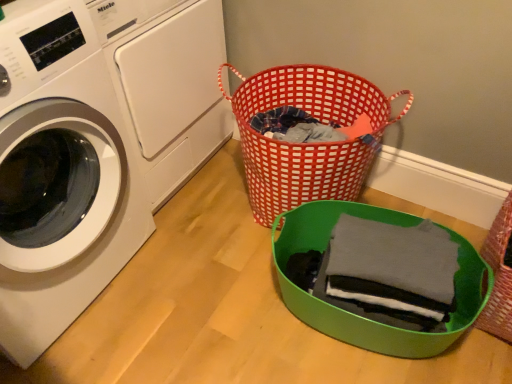
Question: Is dark gray cotton shirt at center at the back of white glossy washing machine at upper left, arranged as the first washing machine when viewed from the back?

Choices:
 (A) yes
 (B) no

Answer: (B)

Question: Is dark gray cotton shirt at center located within white glossy washing machine at upper left, arranged as the first washing machine when viewed from the back?

Choices:
 (A) yes
 (B) no

Answer: (B)

Question: Is white glossy washing machine at upper left, arranged as the first washing machine when viewed from the back, to the left of dark gray cotton shirt at center from the viewer's perspective?

Choices:
 (A) yes
 (B) no

Answer: (A)

Question: Can you confirm if white glossy washing machine at upper left, which ranks as the second washing machine in front-to-back order, is taller than dark gray cotton shirt at center?

Choices:
 (A) no
 (B) yes

Answer: (B)

Question: Is white glossy washing machine at upper left, arranged as the first washing machine when viewed from the back, directly adjacent to dark gray cotton shirt at center?

Choices:
 (A) yes
 (B) no

Answer: (B)

Question: Does white glossy washing machine at upper left, arranged as the first washing machine when viewed from the back, have a larger size compared to dark gray cotton shirt at center?

Choices:
 (A) no
 (B) yes

Answer: (B)

Question: Is dark gray cotton shirt at center taller than white glossy washing machine at left, arranged as the 1th washing machine when viewed from the front?

Choices:
 (A) yes
 (B) no

Answer: (B)

Question: Is dark gray cotton shirt at center not within white glossy washing machine at left, arranged as the 1th washing machine when viewed from the front?

Choices:
 (A) yes
 (B) no

Answer: (A)

Question: Can you confirm if dark gray cotton shirt at center is shorter than white glossy washing machine at left, arranged as the 1th washing machine when viewed from the front?

Choices:
 (A) no
 (B) yes

Answer: (B)

Question: From a real-world perspective, is dark gray cotton shirt at center over white glossy washing machine at left, which appears as the second washing machine when viewed from the back?

Choices:
 (A) yes
 (B) no

Answer: (B)

Question: Does dark gray cotton shirt at center have a smaller size compared to white glossy washing machine at left, arranged as the 1th washing machine when viewed from the front?

Choices:
 (A) no
 (B) yes

Answer: (B)

Question: Are dark gray cotton shirt at center and white glossy washing machine at left, arranged as the 1th washing machine when viewed from the front, far apart?

Choices:
 (A) yes
 (B) no

Answer: (B)

Question: From the image's perspective, is rustic woven basket at lower right, the 1th basket viewed from the right, beneath red woven basket at center, placed as the first basket when sorted from left to right?

Choices:
 (A) no
 (B) yes

Answer: (B)